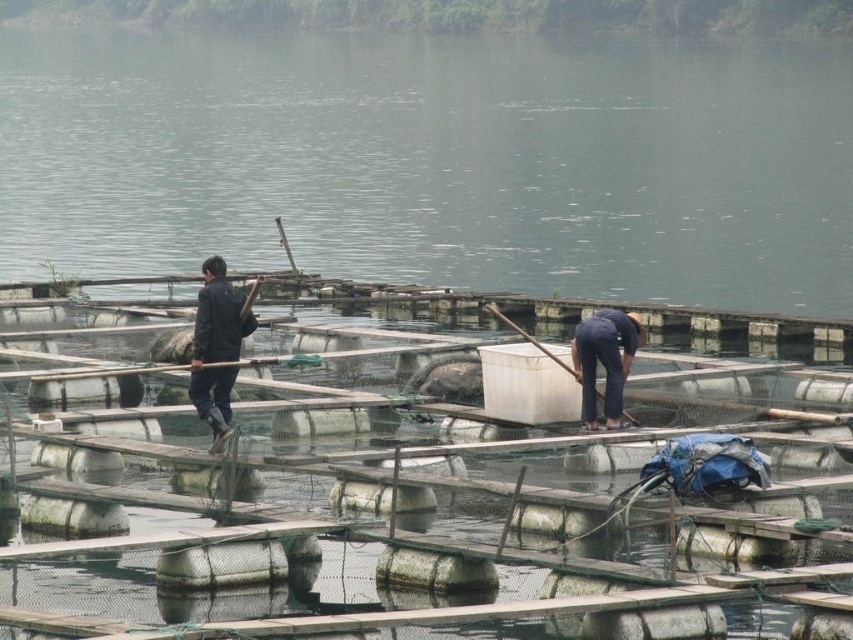
Based on the photo, you are standing at the edge of the fish farm and want to reach the point marked as point (254, 234). If your walking speed is 1.5 meters per second, how long will it take you to reach that point?

The point (254, 234) is 87.70 meters away from the viewer. At a walking speed of 1.5 meters per second, it will take approximately 58.47 seconds to reach the point.

Based on the scene description, what is located at the coordinates point (436, 161)?

At point (436, 161) lies clear water at center.